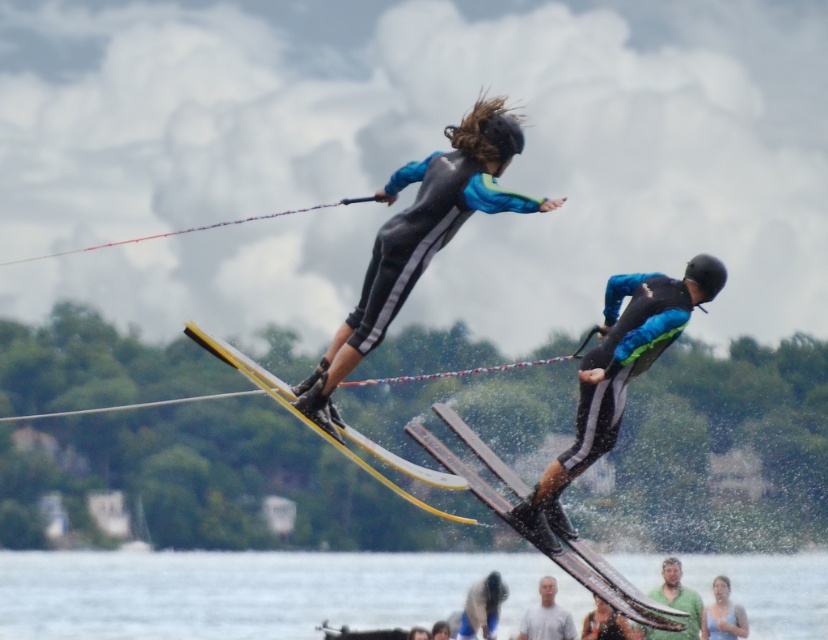
Question: Is yellow matte skis at center to the right of gray matte shirt at lower center from the viewer's perspective?

Choices:
 (A) yes
 (B) no

Answer: (B)

Question: Among these objects, which one is nearest to the camera?

Choices:
 (A) matte black ski at center
 (B) light blue fabric shirt at lower center
 (C) metallic silver skis at center

Answer: (A)

Question: Can you confirm if clear water at lower center is positioned to the left of gray matte shirt at lower center?

Choices:
 (A) no
 (B) yes

Answer: (B)

Question: Is matte black water skis at center smaller than metallic silver skis at center?

Choices:
 (A) yes
 (B) no

Answer: (A)

Question: Which object is closer to the camera taking this photo?

Choices:
 (A) yellow matte skis at center
 (B) light blue fabric shirt at lower center

Answer: (A)

Question: Which of the following is the closest to the observer?

Choices:
 (A) metallic silver skis at center
 (B) matte black water skis at center

Answer: (B)